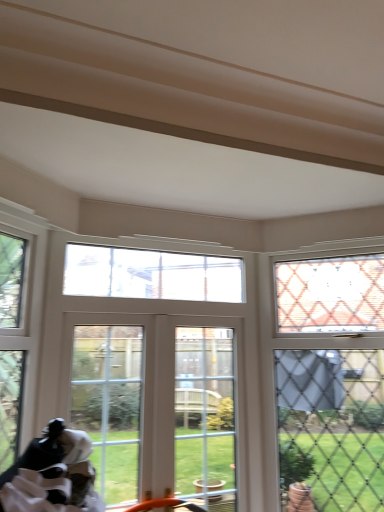
Question: From the image's perspective, is clear glass window at center, the 2th window positioned from the left, beneath clear glass door at center, the second window when ordered from right to left?

Choices:
 (A) no
 (B) yes

Answer: (A)

Question: From a real-world perspective, is clear glass window at center, which is counted as the 3th window, starting from the right, located beneath clear glass door at center, which is the third window in left-to-right order?

Choices:
 (A) no
 (B) yes

Answer: (A)

Question: Is clear glass window at center, the 2th window positioned from the left, not close to clear glass door at center, the second window when ordered from right to left?

Choices:
 (A) yes
 (B) no

Answer: (B)

Question: From the image's perspective, does clear glass window at center, which is counted as the 3th window, starting from the right, appear higher than clear glass door at center, which is the third window in left-to-right order?

Choices:
 (A) no
 (B) yes

Answer: (B)

Question: Is clear glass window at center, the 2th window positioned from the left, surrounding clear glass door at center, which is the third window in left-to-right order?

Choices:
 (A) yes
 (B) no

Answer: (B)

Question: Is clear glass window at center, which is counted as the 3th window, starting from the right, positioned in front of clear glass door at center, which is the third window in left-to-right order?

Choices:
 (A) yes
 (B) no

Answer: (B)

Question: Is clear glass door at center shorter than clear glass window at upper right, which is the 4th window from left to right?

Choices:
 (A) yes
 (B) no

Answer: (A)

Question: Does clear glass door at center contain clear glass window at upper right, which is the 4th window from left to right?

Choices:
 (A) yes
 (B) no

Answer: (B)

Question: Considering the relative positions of clear glass door at center and clear glass window at upper right, which is the 4th window from left to right, in the image provided, is clear glass door at center behind clear glass window at upper right, which is the 4th window from left to right,?

Choices:
 (A) yes
 (B) no

Answer: (A)

Question: Is clear glass door at center outside of clear glass window at upper right, the first window from the right?

Choices:
 (A) yes
 (B) no

Answer: (A)

Question: Is clear glass window at upper right, the first window from the right, at the back of clear glass door at center?

Choices:
 (A) yes
 (B) no

Answer: (B)

Question: From the image's perspective, would you say clear glass door at center is shown under clear glass window at upper right, the first window from the right?

Choices:
 (A) no
 (B) yes

Answer: (B)

Question: Is clear glass door at center further to the viewer compared to clear glass window at upper left, which is the 1th window in left-to-right order?

Choices:
 (A) yes
 (B) no

Answer: (A)